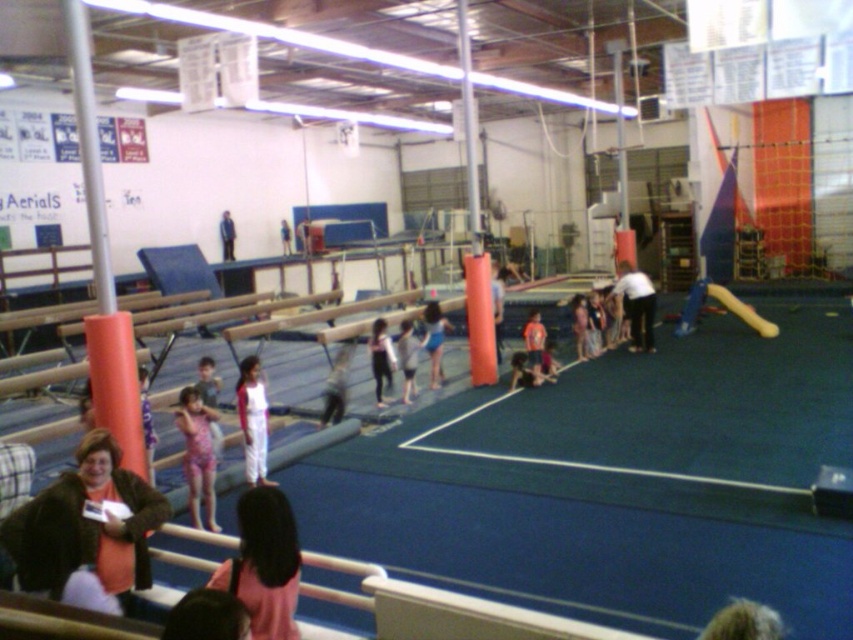
Question: Estimate the real-world distances between objects in this image. Which object is closer to the white cotton shirt at upper center?

Choices:
 (A) orange fabric shorts at center
 (B) white cotton shirt at center
 (C) white fabric at center

Answer: (C)

Question: Can you confirm if matte black jacket at lower left is positioned above purple fabric swimsuit at center?

Choices:
 (A) no
 (B) yes

Answer: (B)

Question: Where is white cotton shorts at center located in relation to white cotton shirt at center in the image?

Choices:
 (A) right
 (B) left

Answer: (B)

Question: Which object appears farthest from the camera in this image?

Choices:
 (A) white cotton shorts at center
 (B) white cotton pants at center

Answer: (A)

Question: Which point is farther from the camera taking this photo?

Choices:
 (A) (189, 420)
 (B) (264, 470)
 (C) (207, 618)
 (D) (291, 512)

Answer: (B)

Question: Can you confirm if white matte shirt at center is positioned to the right of white fabric pants at center?

Choices:
 (A) no
 (B) yes

Answer: (B)